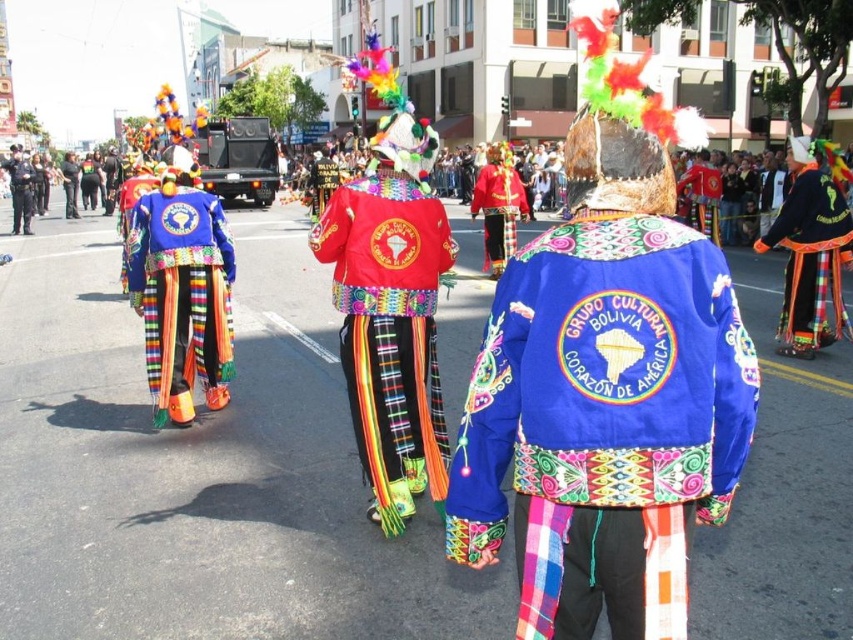
Question: Considering the real-world distances, which object is farthest from the matte blue fabric jacket at center?

Choices:
 (A) blue satin jacket at center
 (B) red velvet jacket at center
 (C) velvet blue jacket at center
 (D) shiny gold mask at center

Answer: (D)

Question: Is red velvet jacket at center below velvet blue jacket at center?

Choices:
 (A) yes
 (B) no

Answer: (A)

Question: Is the position of red velvet jacket at center less distant than that of velvet blue jacket at center?

Choices:
 (A) no
 (B) yes

Answer: (B)

Question: Estimate the real-world distances between objects in this image. Which object is farther from the matte blue fabric jacket at center?

Choices:
 (A) shiny gold mask at center
 (B) blue satin jacket at center

Answer: (A)

Question: Which point is farther from the camera taking this photo?

Choices:
 (A) (543, 634)
 (B) (486, 236)
 (C) (192, 196)

Answer: (B)

Question: Is red velvet jacket at center smaller than black uniform at left?

Choices:
 (A) yes
 (B) no

Answer: (A)